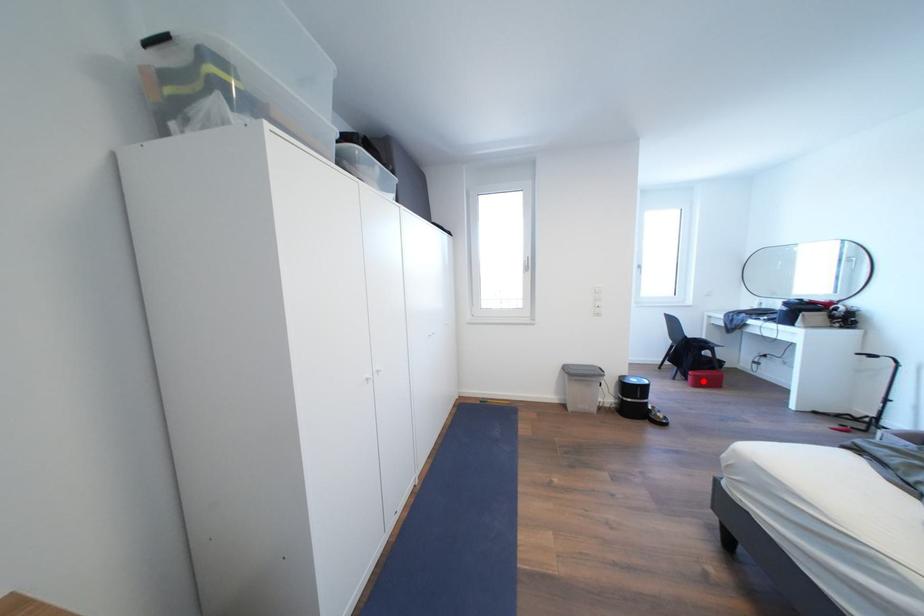
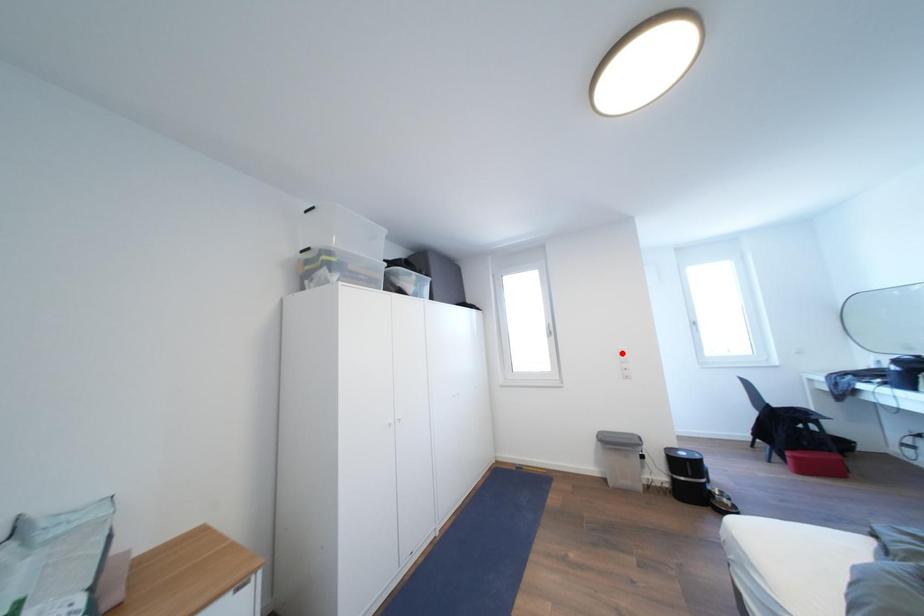
I am providing you with two images of the same scene from different viewpoints. A red point is marked on the first image and another point is marked on the second image. Does the point marked in image1 correspond to the same location as the one in image2?

No